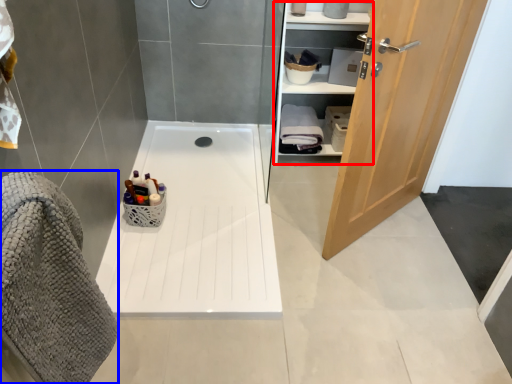
Question: Which object appears farthest to the camera in this image, closet (highlighted by a red box) or bath towel (highlighted by a blue box)?

Choices:
 (A) closet
 (B) bath towel

Answer: (A)